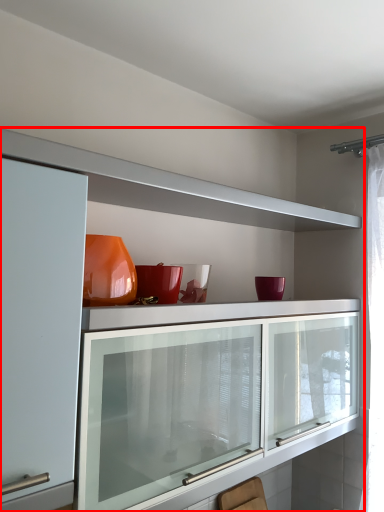
Question: From the image, what is the correct spatial relationship of cabinetry (annotated by the red box) in relation to swivel chair?

Choices:
 (A) right
 (B) left

Answer: (B)